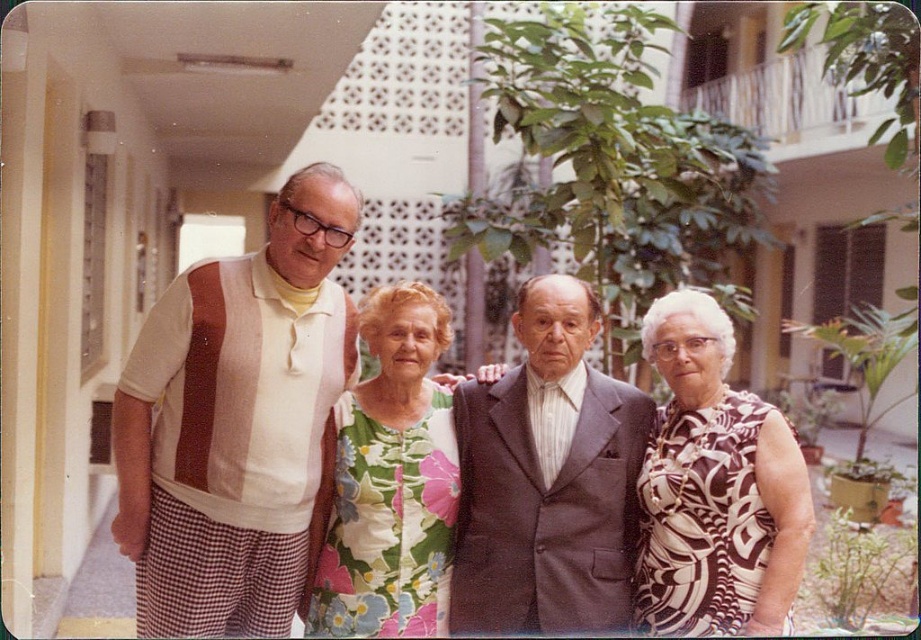
You are a photographer planning to take a group photo of the individuals in the scene. You want to ensure that both the floral fabric blouse at center and the dark gray suit at center are clearly visible. Considering their widths, which clothing item should you position closer to the camera to avoid being obscured by the other?

The floral fabric blouse at center is wider than the dark gray suit at center. To prevent the narrower dark gray suit at center from being obscured, position it closer to the camera so its smaller width remains visible.

Based on the photo, based on the scene description, where is the dark gray suit at center located in terms of coordinates?

The dark gray suit at center is located at point (546, 477).